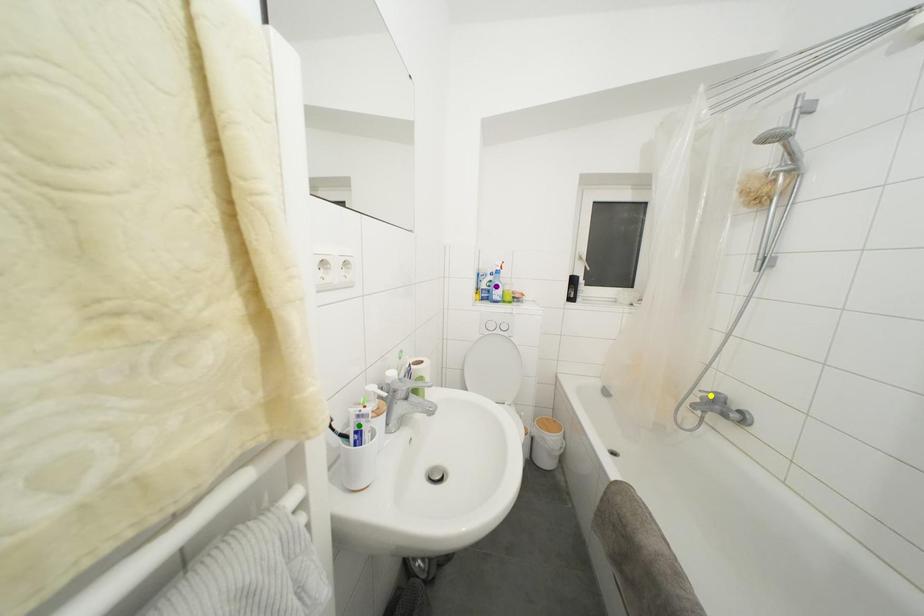
Order these from nearest to farthest:
purple point | green point | yellow point

green point → yellow point → purple point